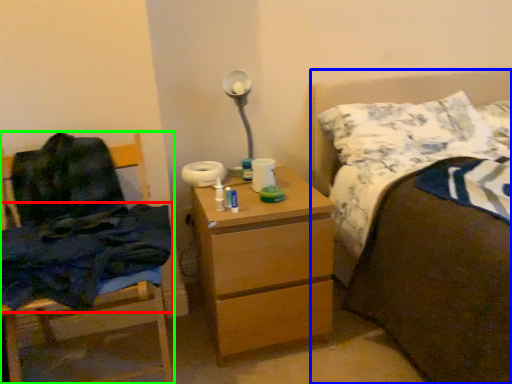
Question: Which object is the farthest from blanket (highlighted by a red box)? Choose among these: bed (highlighted by a blue box) or chair (highlighted by a green box).

Choices:
 (A) bed
 (B) chair

Answer: (A)